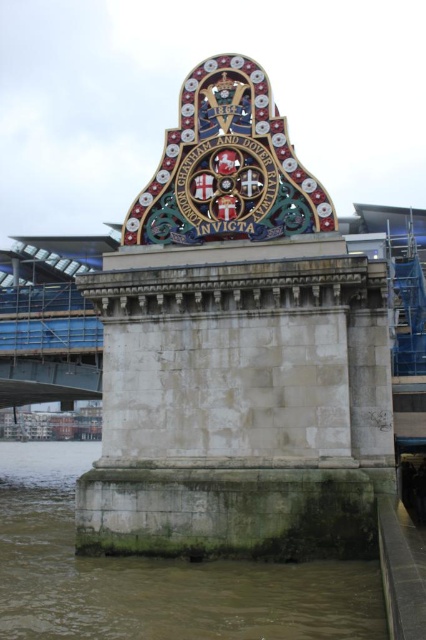
Consider the image. Based on the scene description, what is the significance of the point marked at coordinates (154, 576)?

The point marked at coordinates (154, 576) indicates the location of the brown stone river at lower left in the scene.

You are an architect examining the structure and need to determine the placement of a new decorative element. Given the presence of both the multicolored mosaic crest at center and the shiny metallic crest at center, which crest should be lowered to ensure the new element can be placed above both without obstruction?

The shiny metallic crest at center should be lowered because it is shorter than the multicolored mosaic crest at center. By lowering the shorter one, both crests will be at the same level, allowing the new decorative element to be placed above them without obstruction.